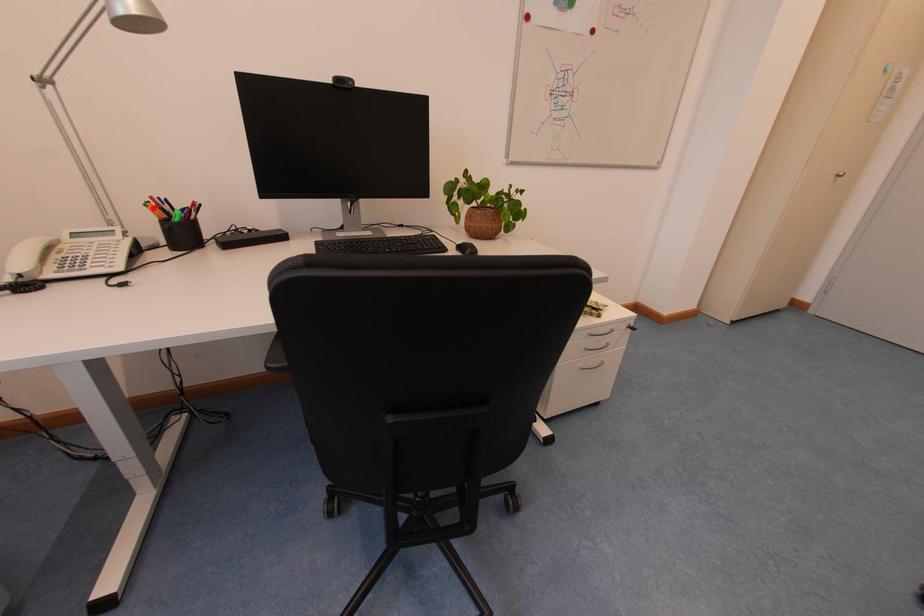
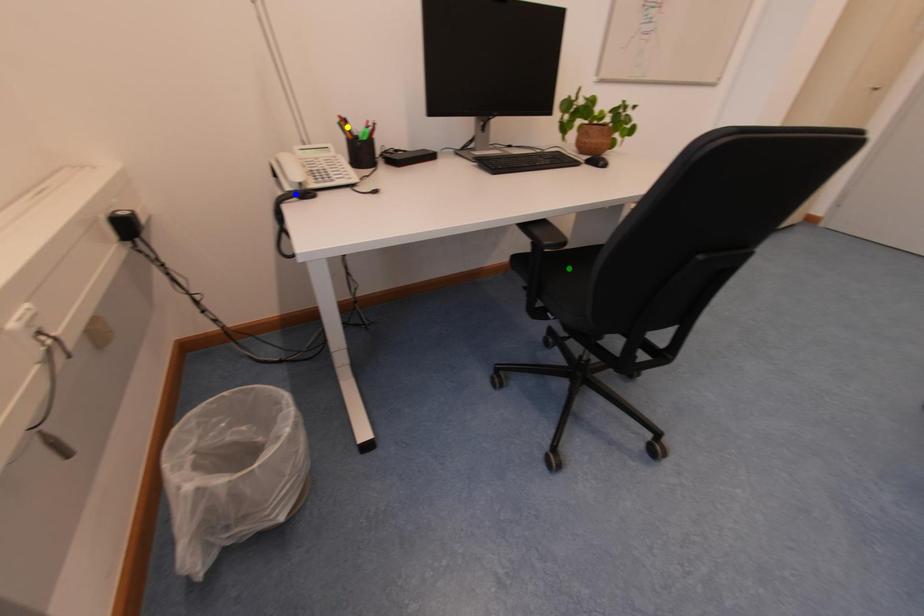
Question: I am providing you with two images of the same scene from different viewpoints. A red point is marked on the first image. You are given multiple points on the second image. In image 2, which mark is for the same physical point as the one in image 1?

Choices:
 (A) blue point
 (B) yellow point
 (C) green point

Answer: (B)